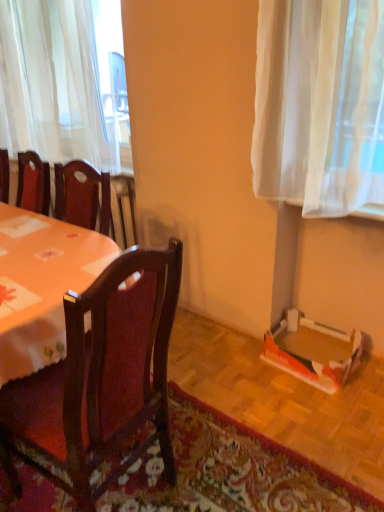
You are a GUI agent. You are given a task and a screenshot of the screen. Output one action in this format:
    pyautogui.click(x=<x>, y=<y>)
    Task: Click on the free space to the left of orange cardboard box at lower right
    
    Given the screenshot: What is the action you would take?
    pyautogui.click(x=247, y=367)